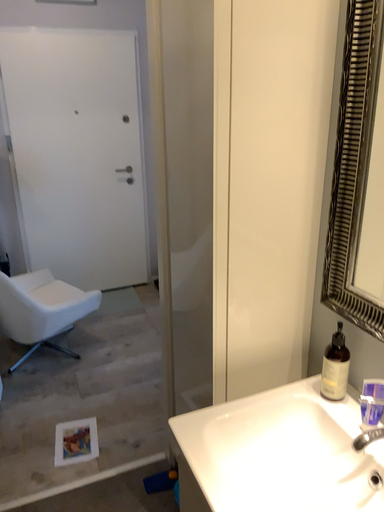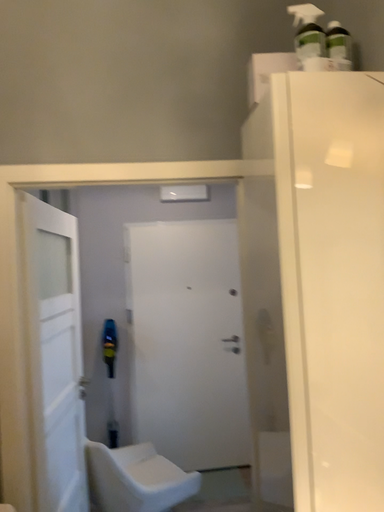
Question: How did the camera likely rotate when shooting the video?

Choices:
 (A) rotated upward
 (B) rotated downward

Answer: (A)